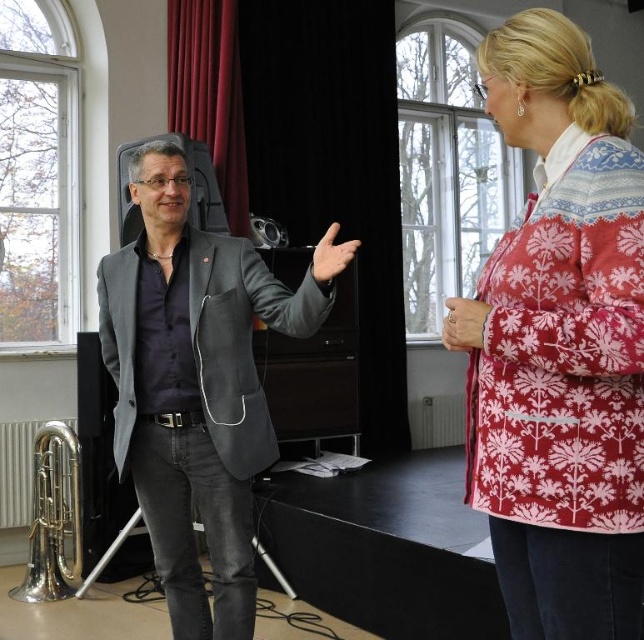
Who is lower down, patterned woolen jacket at upper right or gray matte blazer at center?

gray matte blazer at center is below.

Which is behind, point (488, 324) or point (240, 524)?

The point (240, 524) is more distant.

Locate an element on the screen. The image size is (644, 640). patterned woolen jacket at upper right is located at coordinates (560, 344).